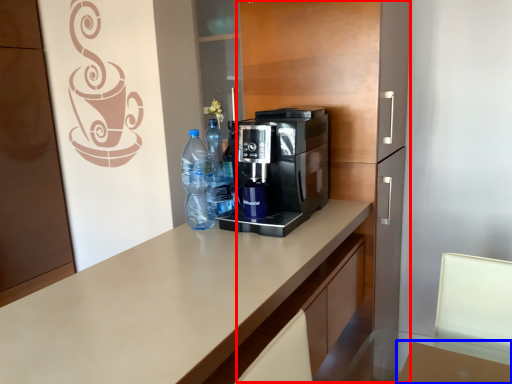
Question: Which of the following is the farthest to the observer, dresser (highlighted by a red box) or table (highlighted by a blue box)?

Choices:
 (A) dresser
 (B) table

Answer: (A)